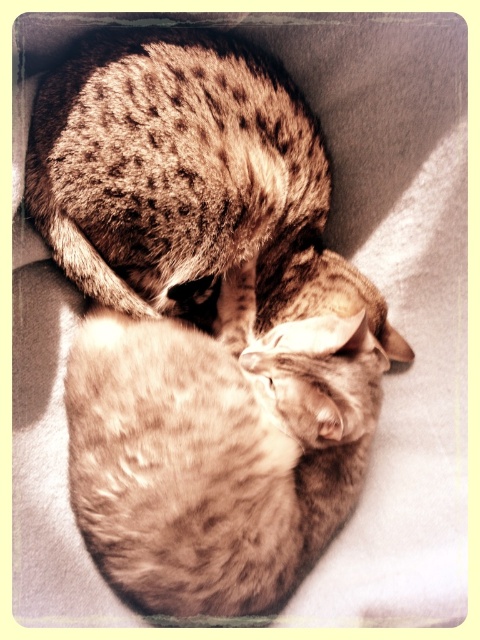
Question: Can you confirm if spotted fur cat at center is positioned to the right of spotted fur cat at upper center?

Choices:
 (A) yes
 (B) no

Answer: (A)

Question: From the image, what is the correct spatial relationship of spotted fur cat at center in relation to spotted fur cat at upper center?

Choices:
 (A) below
 (B) above

Answer: (A)

Question: Which point is closer to the camera?

Choices:
 (A) spotted fur cat at center
 (B) spotted fur cat at upper center

Answer: (A)

Question: Is spotted fur cat at center positioned behind spotted fur cat at upper center?

Choices:
 (A) no
 (B) yes

Answer: (A)

Question: Which point is farther to the camera?

Choices:
 (A) tap(206, 36)
 (B) tap(92, 384)

Answer: (A)

Question: Which object appears farthest from the camera in this image?

Choices:
 (A) spotted fur cat at center
 (B) spotted fur cat at upper center

Answer: (B)